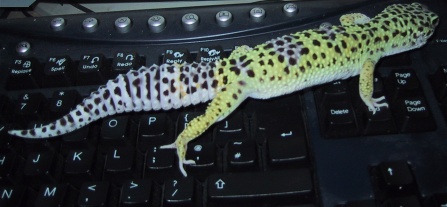
This screenshot has height=207, width=447. Find the location of `keyboard`. keyboard is located at coordinates [x=305, y=117].